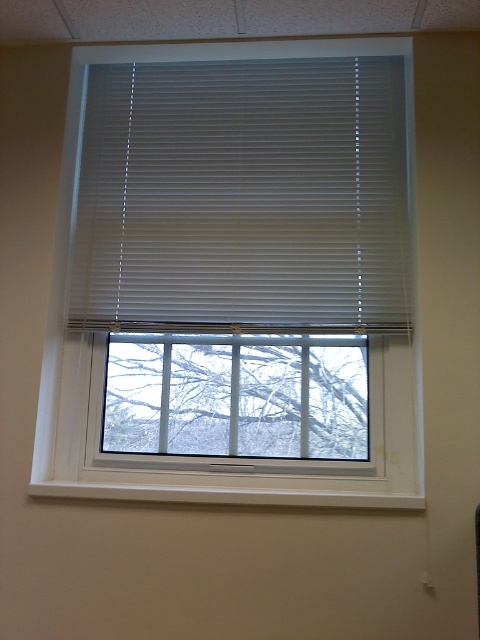
You are standing in a room with a window. You want to look outside through the white matte blinds at center. Where should you stand to see the outside view best?

You should stand at point (243,196) to see the outside view best through the white matte blinds at center.

You are standing in a room with a window that has white horizontal blinds. You want to know what object is located at the coordinate point (243,196) on the window. Can you tell me what object is there?

The point (243,196) corresponds to white matte blinds at center.